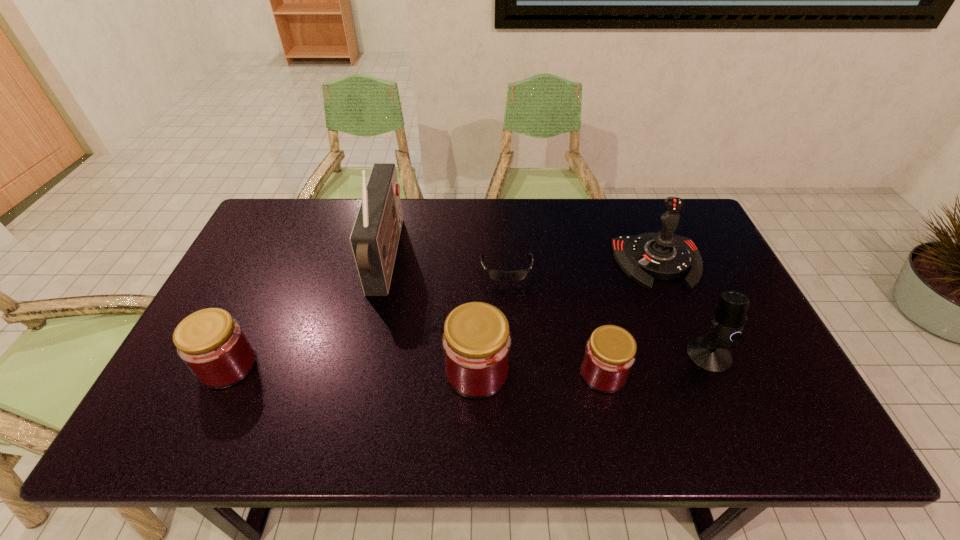
Image resolution: width=960 pixels, height=540 pixels. Find the location of `the leftmost object`. the leftmost object is located at coordinates (213, 345).

The height and width of the screenshot is (540, 960). I want to click on the third shortest object, so click(213, 345).

This screenshot has width=960, height=540. Identify the location of the second jam from left to right. (476, 342).

Locate an element on the screen. the shortest jam is located at coordinates (610, 352).

Locate an element on the screen. the rightmost jam is located at coordinates (610, 352).

This screenshot has width=960, height=540. In order to click on the tallest object in this screenshot , I will do `click(374, 239)`.

The width and height of the screenshot is (960, 540). I want to click on radio receiver, so click(374, 239).

I want to click on the shortest object, so click(x=497, y=275).

The width and height of the screenshot is (960, 540). Identify the location of joystick. (663, 255).

The image size is (960, 540). I want to click on microphone, so click(x=710, y=353).